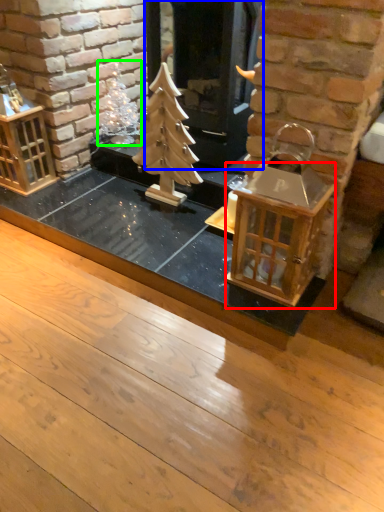
Question: Considering the real-world distances, which object is closest to table (highlighted by a red box)? fireplace (highlighted by a blue box) or christmas decoration (highlighted by a green box).

Choices:
 (A) fireplace
 (B) christmas decoration

Answer: (A)